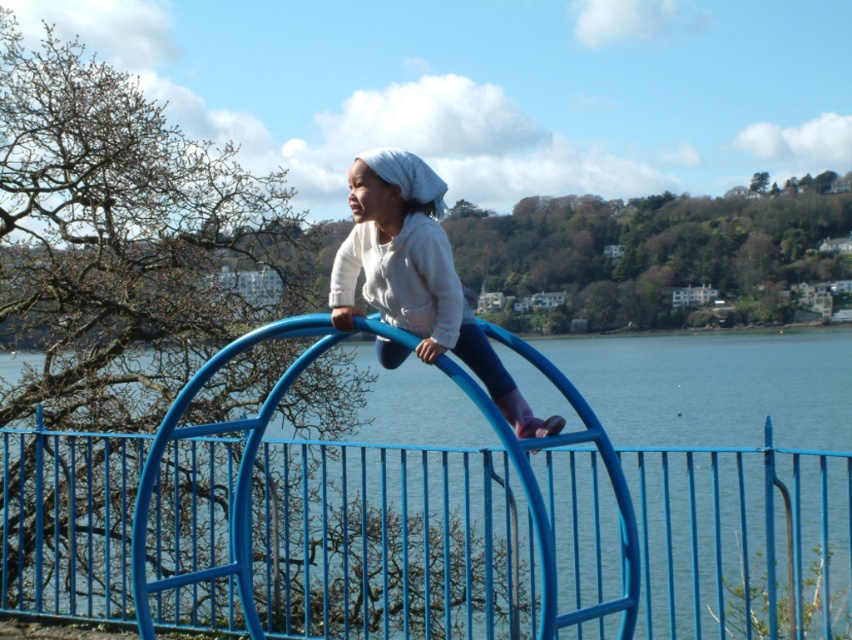
Question: Which point is closer to the camera taking this photo?

Choices:
 (A) (377, 516)
 (B) (378, 305)

Answer: (B)

Question: Is blue metal fence at center positioned behind matte white hoodie at center?

Choices:
 (A) no
 (B) yes

Answer: (A)

Question: Can you confirm if blue metal fence at center is thinner than matte white hoodie at center?

Choices:
 (A) no
 (B) yes

Answer: (A)

Question: Which point is closer to the camera taking this photo?

Choices:
 (A) (387, 156)
 (B) (68, 440)

Answer: (A)

Question: Can you confirm if blue metal fence at center is thinner than matte white hoodie at center?

Choices:
 (A) yes
 (B) no

Answer: (B)

Question: Among these points, which one is farthest from the camera?

Choices:
 (A) (344, 305)
 (B) (822, 536)

Answer: (B)